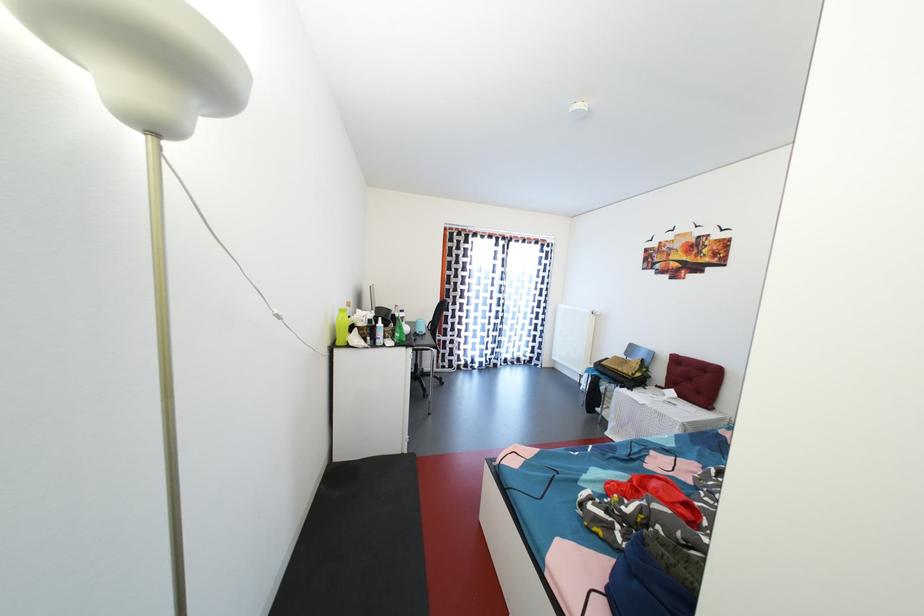
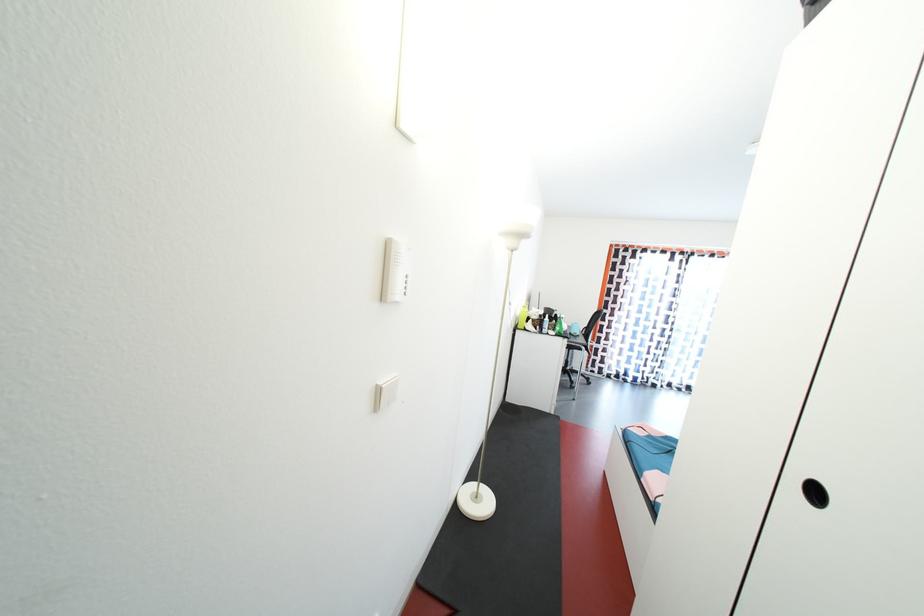
The point at [386,330] is marked in the first image. Where is the corresponding point in the second image?

(553, 323)